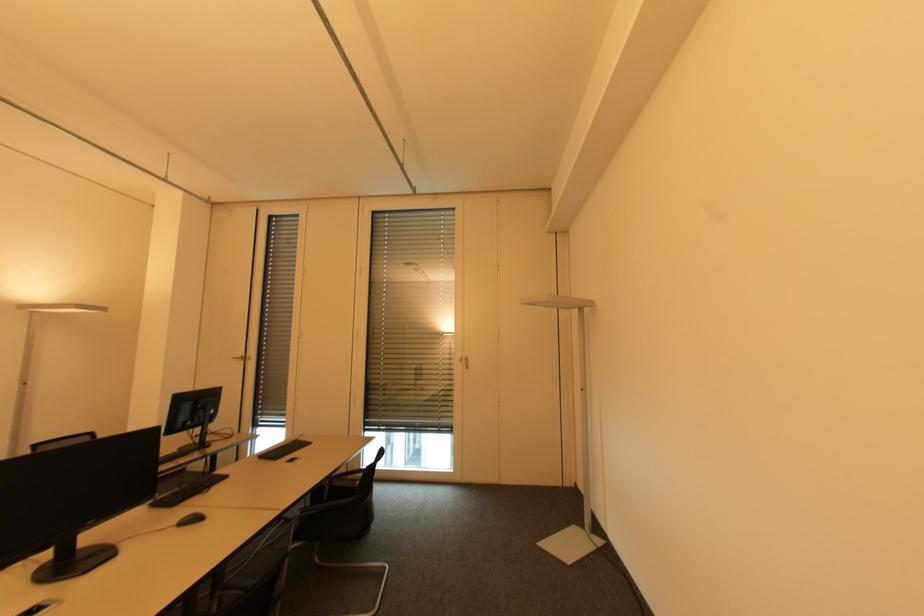
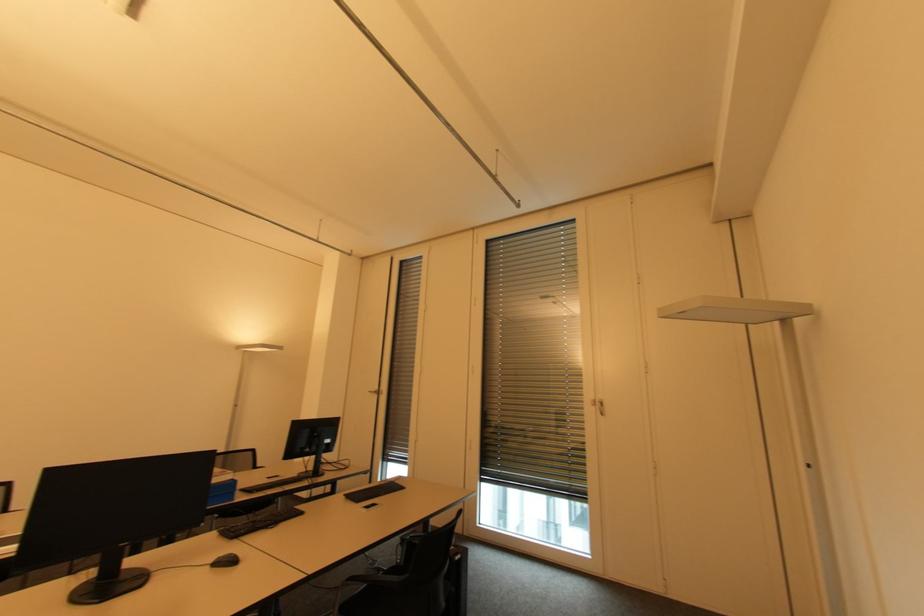
Locate, in the second image, the point that corresponds to [368,424] in the first image.

(483, 474)